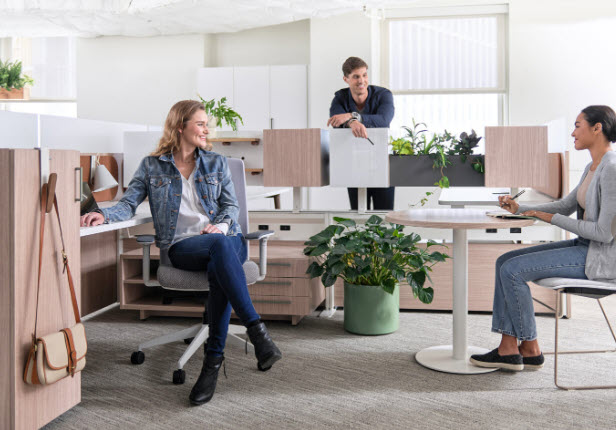
Where is `table`? Image resolution: width=616 pixels, height=430 pixels. table is located at coordinates (463, 217).